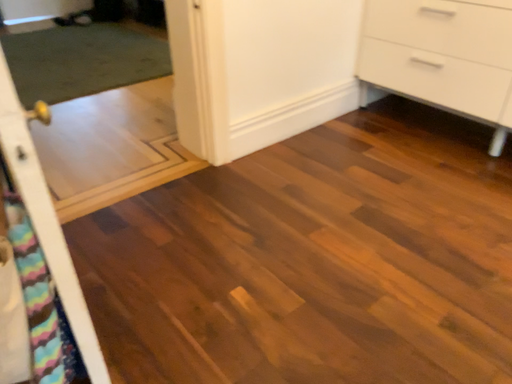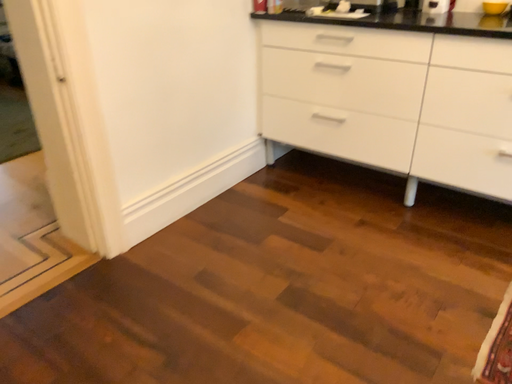
Question: Which way did the camera rotate in the video?

Choices:
 (A) rotated upward
 (B) rotated downward

Answer: (A)